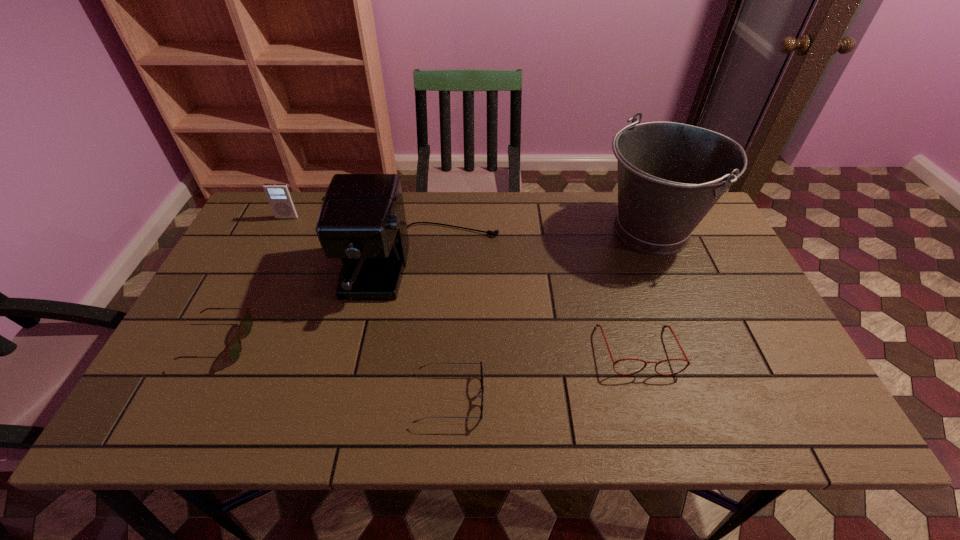
This screenshot has width=960, height=540. Find the location of `vacant space located on the face of the rightmost spectacles`. vacant space located on the face of the rightmost spectacles is located at coordinates (651, 396).

In order to click on blank space located at the front view of the leftmost spectacles in this screenshot , I will do [366, 343].

Locate an element on the screen. The image size is (960, 540). vacant space located 0.400m through the lenses of the second spectacles from left to right is located at coordinates (667, 398).

Locate an element on the screen. bucket located at the far edge is located at coordinates (670, 175).

Image resolution: width=960 pixels, height=540 pixels. What are the coordinates of `coffee maker at the far edge` in the screenshot? It's located at (362, 220).

Locate an element on the screen. This screenshot has height=540, width=960. iPod at the far edge is located at coordinates (279, 196).

You are a GUI agent. You are given a task and a screenshot of the screen. Output one action in this format:
    pyautogui.click(x=<x>, y=<y>)
    Task: Click on the object located at the near edge
    The height and width of the screenshot is (540, 960).
    Given the screenshot: What is the action you would take?
    pyautogui.click(x=480, y=396)

Where is `iPod that is at the left edge`? iPod that is at the left edge is located at coordinates (279, 196).

The image size is (960, 540). What are the coordinates of `spectacles present at the left edge` in the screenshot? It's located at (233, 352).

Identify the location of object that is at the right edge. (670, 175).